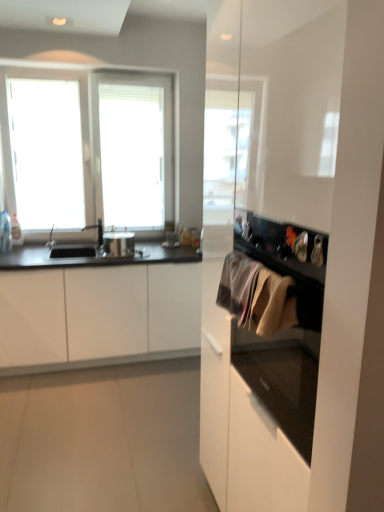
Where is `free space on the front side of silver metallic faucet at left`? The image size is (384, 512). free space on the front side of silver metallic faucet at left is located at coordinates (85, 252).